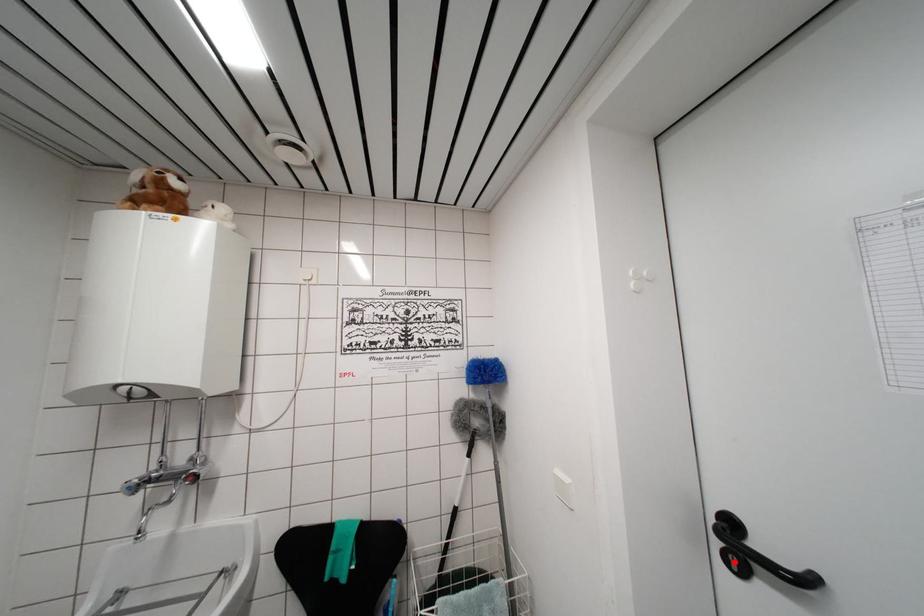
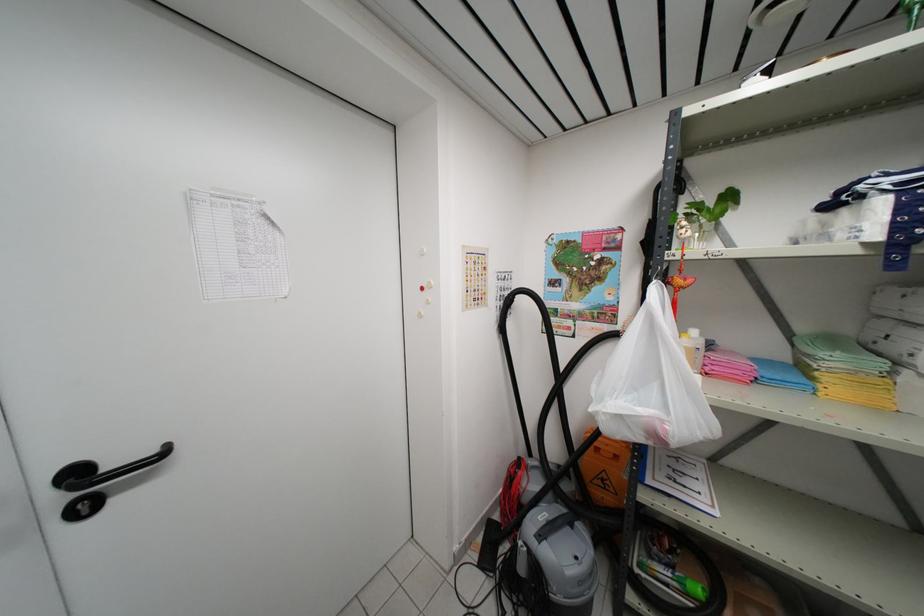
Question: I am providing you with two images of the same scene from different viewpoints. In image1, a red point is highlighted. Considering the same 3D point in image2, which of the following is correct?

Choices:
 (A) It is closer
 (B) It is farther

Answer: (A)